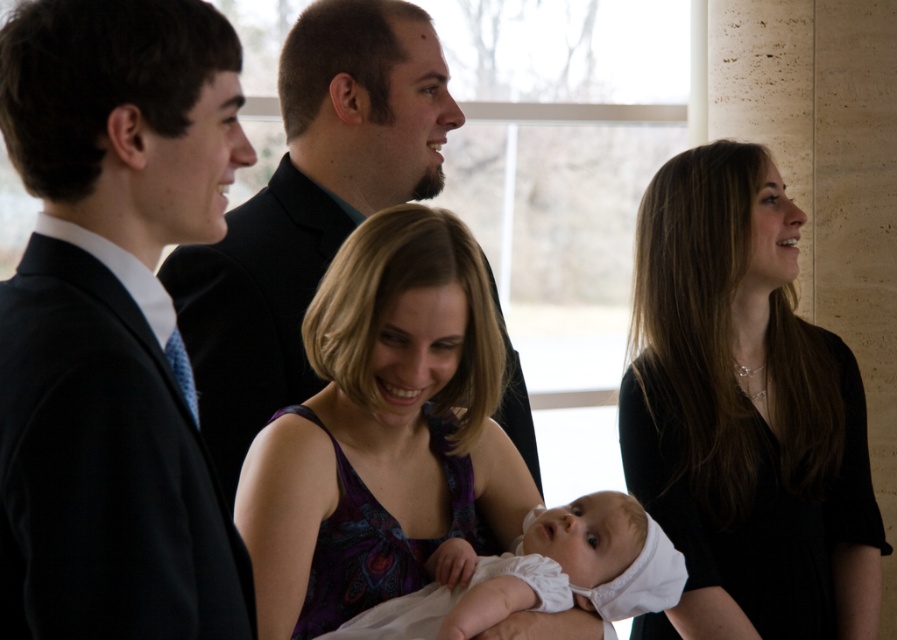
Question: Is black matte dress at center positioned at the back of white soft fabric baby at center?

Choices:
 (A) yes
 (B) no

Answer: (A)

Question: Which object is farther from the camera taking this photo?

Choices:
 (A) purple satin dress at center
 (B) matte black suit at left
 (C) black matte dress at center
 (D) white soft fabric baby at center

Answer: (C)

Question: Can you confirm if matte black suit at center is positioned to the left of white soft fabric baby at center?

Choices:
 (A) no
 (B) yes

Answer: (B)

Question: Does black matte dress at center have a greater width compared to white soft fabric baby at center?

Choices:
 (A) no
 (B) yes

Answer: (A)

Question: Estimate the real-world distances between objects in this image. Which object is closer to the matte black suit at left?

Choices:
 (A) white soft fabric baby at center
 (B) matte black suit at center

Answer: (A)

Question: Which point is closer to the camera?

Choices:
 (A) (504, 506)
 (B) (63, 67)
 (C) (633, 556)
 (D) (637, 438)

Answer: (B)